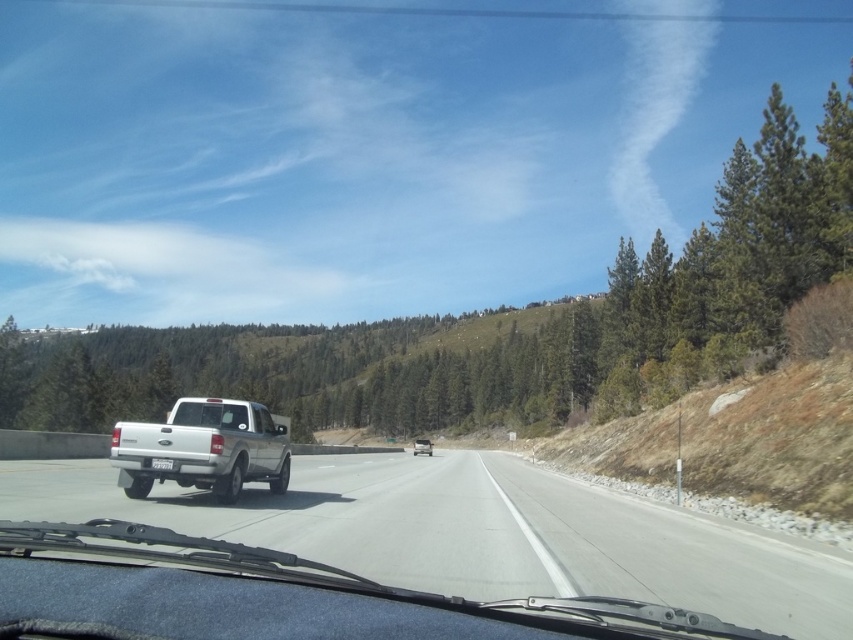
Which is below, white glossy truck at center or clear glass windshield at center?

white glossy truck at center is below.

Between point (457, 524) and point (235, 422), which one is positioned in front?

Point (457, 524)

Where is `white glossy truck at center`? This screenshot has height=640, width=853. white glossy truck at center is located at coordinates (488, 534).

At what (x,y) coordinates should I click in order to perform the action: click on white glossy truck at center. Please return your answer as a coordinate pair (x, y). The height and width of the screenshot is (640, 853). Looking at the image, I should click on (488, 534).

Looking at this image, can you confirm if white glossy truck at center is positioned to the right of white matte truck at center?

Incorrect, white glossy truck at center is not on the right side of white matte truck at center.

Between point (821, 547) and point (422, 445), which one is positioned in front?

Point (821, 547) is more forward.

Is point (720, 577) positioned behind point (431, 452)?

No, (720, 577) is in front of (431, 452).

At what (x,y) coordinates should I click in order to perform the action: click on white glossy truck at center. Please return your answer as a coordinate pair (x, y). Image resolution: width=853 pixels, height=640 pixels. Looking at the image, I should click on (488, 534).

Is white matte pickup truck at center positioned in front of white matte truck at center?

Yes, white matte pickup truck at center is closer to the viewer.

Between point (218, 413) and point (419, 452), which one is positioned behind?

The point (419, 452) is behind.

The height and width of the screenshot is (640, 853). Identify the location of white matte pickup truck at center. (202, 449).